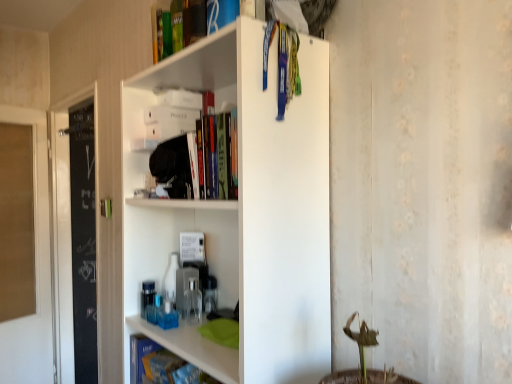
Question: Is the position of white matte shelf at upper center more distant than that of blue matte book at lower left, positioned as the 3th book in top-to-bottom order?

Choices:
 (A) yes
 (B) no

Answer: (B)

Question: Considering the relative sizes of white matte shelf at upper center and blue matte book at lower left, positioned as the 3th book in top-to-bottom order, in the image provided, is white matte shelf at upper center bigger than blue matte book at lower left, positioned as the 3th book in top-to-bottom order,?

Choices:
 (A) yes
 (B) no

Answer: (A)

Question: Can you confirm if white matte shelf at upper center is taller than blue matte book at lower left, positioned as the 3th book in top-to-bottom order?

Choices:
 (A) yes
 (B) no

Answer: (A)

Question: Is blue matte book at lower left, positioned as the 3th book in top-to-bottom order, at the back of white matte shelf at upper center?

Choices:
 (A) no
 (B) yes

Answer: (A)

Question: Is white matte shelf at upper center smaller than blue matte book at lower left, acting as the 1th book starting from the bottom?

Choices:
 (A) yes
 (B) no

Answer: (B)

Question: Is white matte shelf at upper center positioned beyond the bounds of blue matte book at lower left, positioned as the 3th book in top-to-bottom order?

Choices:
 (A) yes
 (B) no

Answer: (A)

Question: From the image's perspective, is blue matte book at lower left, acting as the 1th book starting from the bottom, under green matte book at upper center, placed as the first book when sorted from top to bottom?

Choices:
 (A) yes
 (B) no

Answer: (A)

Question: From the image's perspective, is blue matte book at lower left, acting as the 1th book starting from the bottom, on top of green matte book at upper center, placed as the first book when sorted from top to bottom?

Choices:
 (A) no
 (B) yes

Answer: (A)

Question: Can you confirm if blue matte book at lower left, positioned as the 3th book in top-to-bottom order, is wider than green matte book at upper center, the 3th book positioned from the bottom?

Choices:
 (A) no
 (B) yes

Answer: (A)

Question: Is blue matte book at lower left, positioned as the 3th book in top-to-bottom order, to the left of green matte book at upper center, the 3th book positioned from the bottom, from the viewer's perspective?

Choices:
 (A) yes
 (B) no

Answer: (A)

Question: Is blue matte book at lower left, acting as the 1th book starting from the bottom, located outside green matte book at upper center, the 3th book positioned from the bottom?

Choices:
 (A) no
 (B) yes

Answer: (B)

Question: Is blue matte book at lower left, acting as the 1th book starting from the bottom, behind green matte book at upper center, the 3th book positioned from the bottom?

Choices:
 (A) no
 (B) yes

Answer: (B)

Question: Does white matte shelf at upper center appear on the left side of blue matte book at lower left, which is counted as the second book, starting from the bottom?

Choices:
 (A) yes
 (B) no

Answer: (B)